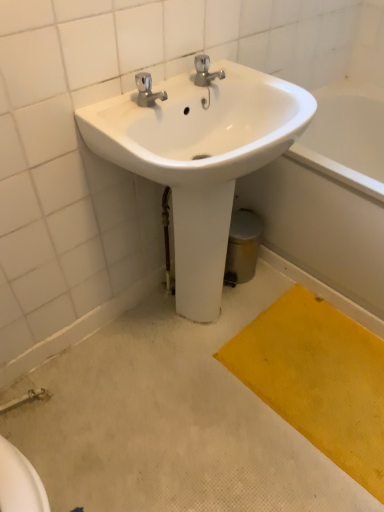
Locate an element on the screen. Image resolution: width=384 pixels, height=512 pixels. vacant area that lies in front of white glossy sink at upper center is located at coordinates (211, 426).